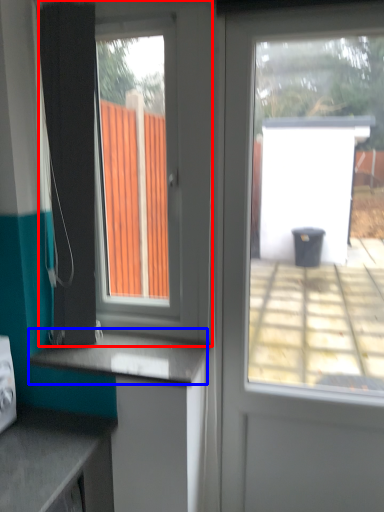
Question: Which object is closer to the camera taking this photo, window (highlighted by a red box) or counter top (highlighted by a blue box)?

Choices:
 (A) window
 (B) counter top

Answer: (A)